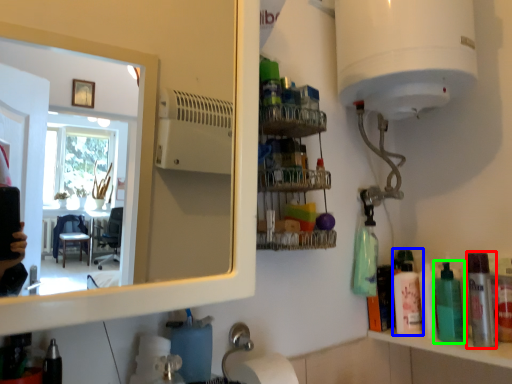
Question: Estimate the real-world distances between objects in this image. Which object is closer to mouthwash (highlighted by a red box), toiletry (highlighted by a blue box) or mouthwash (highlighted by a green box)?

Choices:
 (A) toiletry
 (B) mouthwash

Answer: (B)